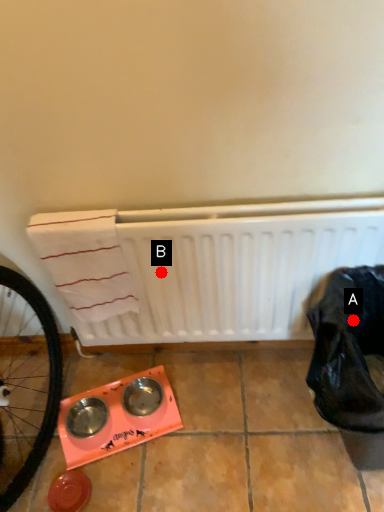
Question: Two points are circled on the image, labeled by A and B beside each circle. Which point is further to the camera?

Choices:
 (A) A is further
 (B) B is further

Answer: (B)